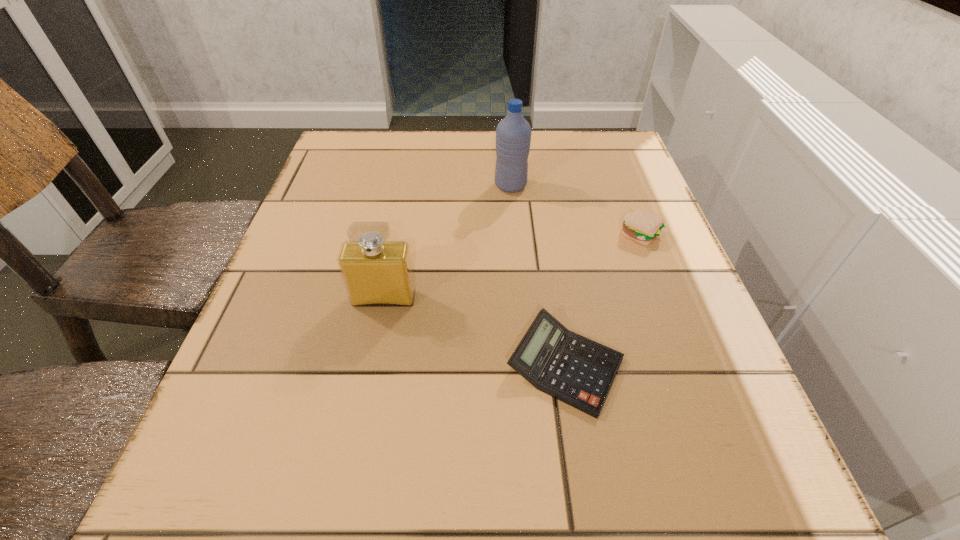
Locate an element on the screen. the farthest object is located at coordinates (513, 133).

At what (x,y) coordinates should I click in order to perform the action: click on the tallest object. Please return your answer as a coordinate pair (x, y). This screenshot has height=540, width=960. Looking at the image, I should click on (513, 133).

Locate an element on the screen. This screenshot has height=540, width=960. the second nearest object is located at coordinates (376, 273).

This screenshot has width=960, height=540. Identify the location of perfume. (376, 273).

The image size is (960, 540). What are the coordinates of `the third nearest object` in the screenshot? It's located at (643, 227).

Locate an element on the screen. This screenshot has height=540, width=960. the rightmost object is located at coordinates (643, 227).

The height and width of the screenshot is (540, 960). Find the location of `the nearest object`. the nearest object is located at coordinates (578, 371).

Find the location of a particular element. The width and height of the screenshot is (960, 540). free space located 0.110m on the front of the farthest object is located at coordinates (514, 226).

I want to click on vacant space located on the front-facing side of the leftmost object, so click(x=369, y=374).

Where is `free point located on the left of the patty`? This screenshot has width=960, height=540. free point located on the left of the patty is located at coordinates (492, 234).